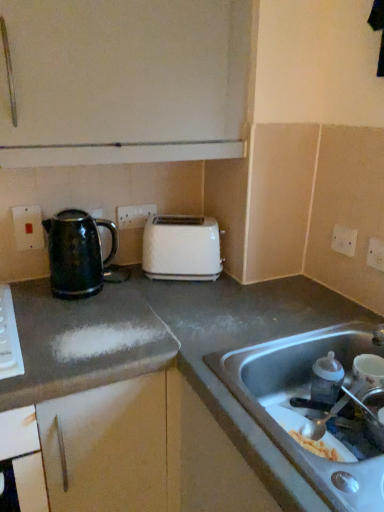
Where is `vacant area situated below shiny metallic kettle at left (from a real-world perspective)`? This screenshot has height=512, width=384. vacant area situated below shiny metallic kettle at left (from a real-world perspective) is located at coordinates (93, 290).